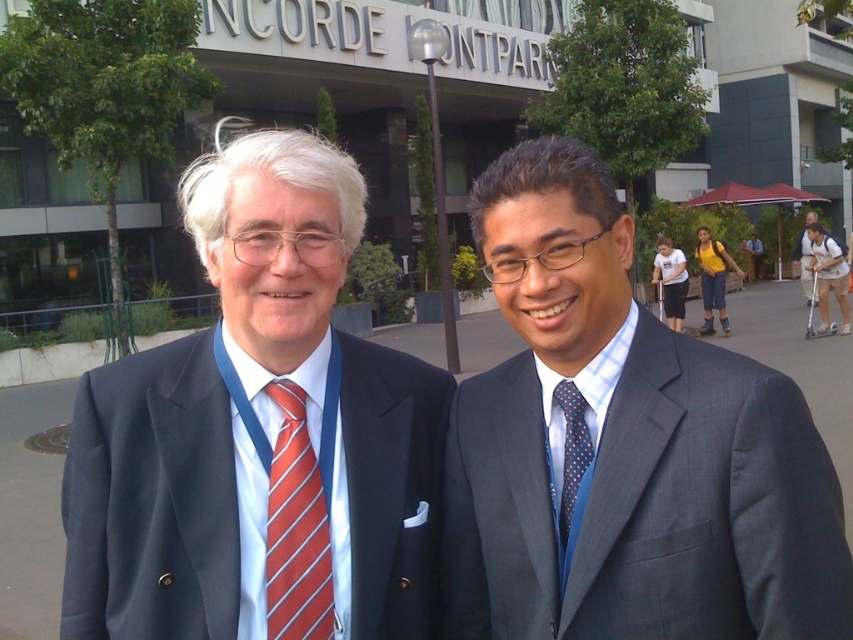
You are a photographer at the event and want to capture a photo where the red striped tie at center is visible without being covered by the blue dotted tie at center. Based on their positions, is this possible?

The red striped tie at center is positioned under the blue dotted tie at center, so it might be partially or fully covered. Adjusting the angle or having the person move slightly could help ensure the red striped tie at center is visible.